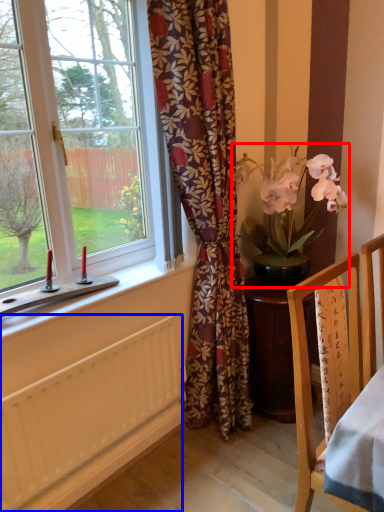
Question: Which of the following is the farthest to the observer, houseplant (highlighted by a red box) or radiator (highlighted by a blue box)?

Choices:
 (A) houseplant
 (B) radiator

Answer: (A)